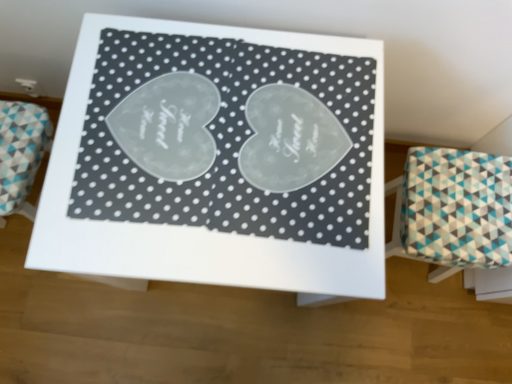
At what (x,y) coordinates should I click in order to perform the action: click on teal and white fabric stool at right. Please return your answer as a coordinate pair (x, y). Image resolution: width=512 pixels, height=384 pixels. Looking at the image, I should click on (453, 210).

This screenshot has width=512, height=384. Describe the element at coordinates (453, 210) in the screenshot. I see `teal and white fabric stool at right` at that location.

Consider the image. In order to face teal and white fabric stool at right, should I rotate leftwards or rightwards?

You should rotate right by 22.102 degrees.

What do you see at coordinates (218, 159) in the screenshot? Image resolution: width=512 pixels, height=384 pixels. I see `white glossy table at center` at bounding box center [218, 159].

Image resolution: width=512 pixels, height=384 pixels. I want to click on white glossy table at center, so click(218, 159).

The image size is (512, 384). In order to click on teal and white fabric stool at right in this screenshot , I will do `click(453, 210)`.

Which object is positioned more to the left, white glossy table at center or teal and white fabric stool at right?

white glossy table at center.

Is the position of white glossy table at center less distant than that of teal and white fabric stool at right?

Yes.

Between point (127, 50) and point (459, 152), which one is positioned behind?

Point (459, 152)

From the image's perspective, would you say white glossy table at center is positioned over teal and white fabric stool at right?

Yes, from the image's perspective, white glossy table at center is on top of teal and white fabric stool at right.

From a real-world perspective, who is located lower, white glossy table at center or teal and white fabric stool at right?

teal and white fabric stool at right is physically lower.

Which object is wider, white glossy table at center or teal and white fabric stool at right?

Wider between the two is white glossy table at center.

Considering the sizes of objects white glossy table at center and teal and white fabric stool at right in the image provided, who is taller, white glossy table at center or teal and white fabric stool at right?

With more height is white glossy table at center.

In terms of size, does white glossy table at center appear bigger or smaller than teal and white fabric stool at right?

Clearly, white glossy table at center is larger in size than teal and white fabric stool at right.

Is white glossy table at center positioned beyond the bounds of teal and white fabric stool at right?

Yes, white glossy table at center is not within teal and white fabric stool at right.

Are white glossy table at center and teal and white fabric stool at right making contact?

No, white glossy table at center is not with teal and white fabric stool at right.

Is white glossy table at center oriented towards teal and white fabric stool at right?

No.

How far apart are white glossy table at center and teal and white fabric stool at right?

The distance of white glossy table at center from teal and white fabric stool at right is 51.07 centimeters.

Find the location of `table above the teal and white fabric stool at right (from a real-world perspective)`. table above the teal and white fabric stool at right (from a real-world perspective) is located at coordinates (218, 159).

Which is more to the left, teal and white fabric stool at right or white glossy table at center?

From the viewer's perspective, white glossy table at center appears more on the left side.

Is the position of teal and white fabric stool at right more distant than that of white glossy table at center?

Yes, the depth of teal and white fabric stool at right is greater than that of white glossy table at center.

Is point (485, 266) positioned after point (252, 190)?

That is True.

From the image's perspective, is teal and white fabric stool at right over white glossy table at center?

No, from the image's perspective, teal and white fabric stool at right is not on top of white glossy table at center.

From a real-world perspective, who is located higher, teal and white fabric stool at right or white glossy table at center?

white glossy table at center is physically above.

Does teal and white fabric stool at right have a greater width compared to white glossy table at center?

In fact, teal and white fabric stool at right might be narrower than white glossy table at center.

Who is taller, teal and white fabric stool at right or white glossy table at center?

With more height is white glossy table at center.

Between teal and white fabric stool at right and white glossy table at center, which one has larger size?

With larger size is white glossy table at center.

Is white glossy table at center surrounded by teal and white fabric stool at right?

No, white glossy table at center is located outside of teal and white fabric stool at right.

Are teal and white fabric stool at right and white glossy table at center making contact?

No, teal and white fabric stool at right is not with white glossy table at center.

Is teal and white fabric stool at right positioned with its back to white glossy table at center?

No.

Where is `table that is above the teal and white fabric stool at right (from the image's perspective)`? The width and height of the screenshot is (512, 384). table that is above the teal and white fabric stool at right (from the image's perspective) is located at coordinates (218, 159).

In the image, there is a white glossy table at center. At what (x,y) coordinates should I click in order to perform the action: click on furniture below it (from the image's perspective). Please return your answer as a coordinate pair (x, y). This screenshot has width=512, height=384. Looking at the image, I should click on (453, 210).

Find the location of `furniture below the white glossy table at center (from a real-world perspective)`. furniture below the white glossy table at center (from a real-world perspective) is located at coordinates point(453,210).